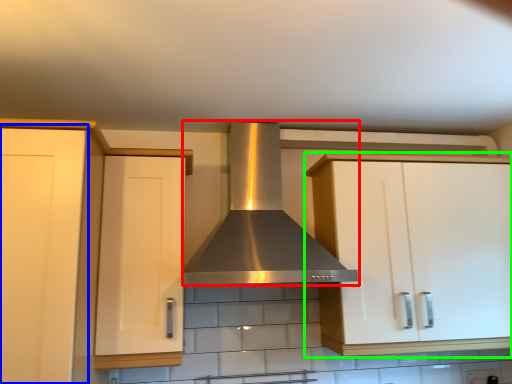
Question: Considering the real-world distances, which object is farthest from home appliance (highlighted by a red box)? cabinetry (highlighted by a blue box) or cabinetry (highlighted by a green box)?

Choices:
 (A) cabinetry
 (B) cabinetry

Answer: (A)